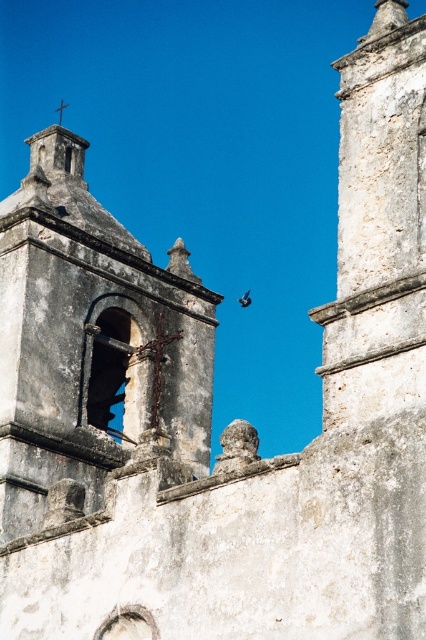
Question: Can you confirm if white stone bell tower at upper left is positioned below brown feathered bird at upper center?

Choices:
 (A) no
 (B) yes

Answer: (A)

Question: Does white stone bell tower at upper left come behind white stone tower at upper right?

Choices:
 (A) yes
 (B) no

Answer: (A)

Question: Which point is closer to the camera?

Choices:
 (A) brown feathered bird at upper center
 (B) white stone tower at upper right

Answer: (B)

Question: Can you confirm if white stone bell tower at upper left is positioned below brown feathered bird at upper center?

Choices:
 (A) no
 (B) yes

Answer: (A)

Question: Which is farther from the white stone bell tower at upper left?

Choices:
 (A) brown feathered bird at upper center
 (B) white stone tower at upper right

Answer: (A)

Question: Which object is closer to the camera taking this photo?

Choices:
 (A) brown feathered bird at upper center
 (B) white stone tower at upper right

Answer: (B)